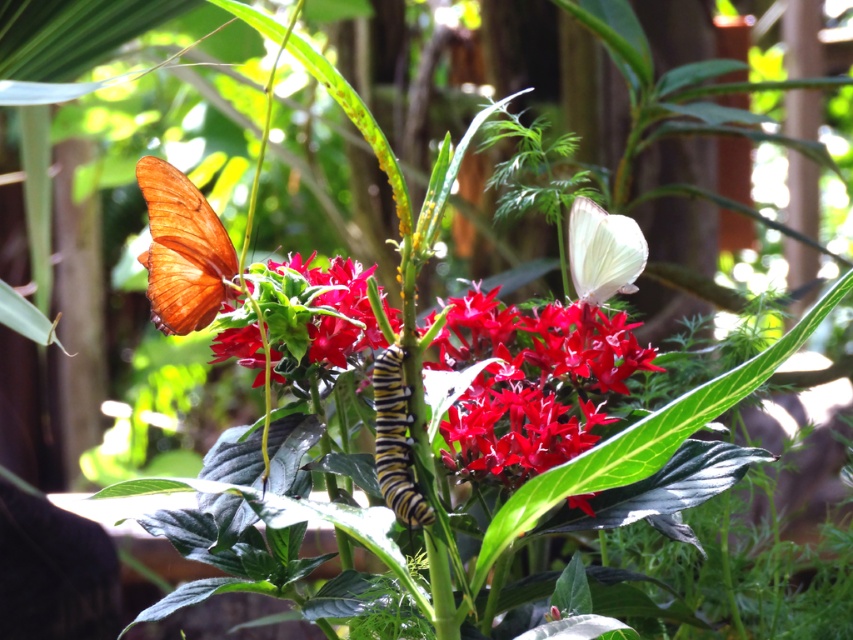
Question: Does shiny orange butterfly at left appear over yellow-black striped caterpillar at center?

Choices:
 (A) yes
 (B) no

Answer: (A)

Question: Is smooth glossy red flower at center below shiny orange butterfly at left?

Choices:
 (A) no
 (B) yes

Answer: (B)

Question: Which point is closer to the camera taking this photo?

Choices:
 (A) (381, 385)
 (B) (181, 218)

Answer: (A)

Question: Which of the following is the closest to the observer?

Choices:
 (A) (631, 246)
 (B) (381, 376)
 (C) (219, 301)
 (D) (578, 307)

Answer: (B)

Question: Which object appears farthest from the camera in this image?

Choices:
 (A) matte white butterfly at upper right
 (B) yellow-black striped caterpillar at center

Answer: (A)

Question: Is matte white butterfly at upper right closer to the viewer compared to yellow-black striped caterpillar at center?

Choices:
 (A) no
 (B) yes

Answer: (A)